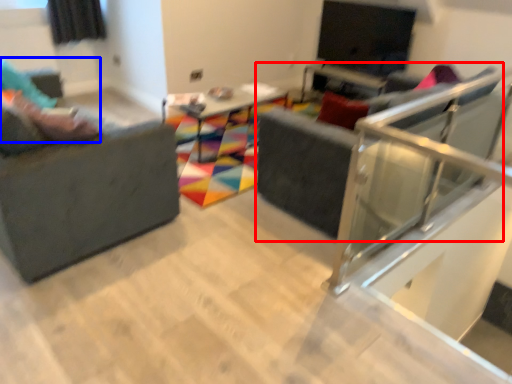
Question: Which object is closer to the camera taking this photo, swivel chair (highlighted by a red box) or person (highlighted by a blue box)?

Choices:
 (A) swivel chair
 (B) person

Answer: (A)